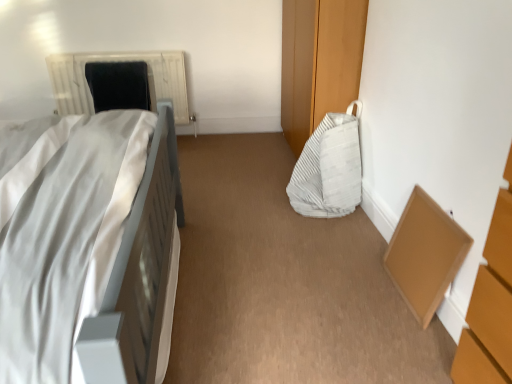
You are a GUI agent. You are given a task and a screenshot of the screen. Output one action in this format:
    pyautogui.click(x=<x>, y=<y>)
    Task: Click on the white matte bed at left
    The height and width of the screenshot is (384, 512).
    Given the screenshot: What is the action you would take?
    pyautogui.click(x=92, y=253)

Identify the location of white textured radiator at upper left. The width and height of the screenshot is (512, 384). (115, 61).

What is the approximate width of brown cardboard box at lower right?

11.20 centimeters.

Locate an element on the screen. The height and width of the screenshot is (384, 512). white striped fabric bean bag at center-right, marked as the first bean bag chair in a right-to-left arrangement is located at coordinates (329, 168).

Find the location of a particular element. Image resolution: width=512 pixels, height=384 pixels. white matte bed at left is located at coordinates (92, 253).

From the image's perspective, would you say white matte bed at left is positioned over white textured radiator at upper left?

No, from the image's perspective, white matte bed at left is not on top of white textured radiator at upper left.

Which of these two, white matte bed at left or white textured radiator at upper left, is bigger?

With larger size is white matte bed at left.

In order to click on radiator lying on the left of white matte bed at left in this screenshot , I will do `click(115, 61)`.

Could you tell me if white matte bed at left is facing white textured radiator at upper left?

No.

Is white textured radiator at upper left in front of or behind white striped fabric bean bag at center-right, which is the 2th bean bag chair from left to right, in the image?

In the image, white textured radiator at upper left appears behind white striped fabric bean bag at center-right, which is the 2th bean bag chair from left to right.

Would you say white striped fabric bean bag at center-right, marked as the first bean bag chair in a right-to-left arrangement, is part of white textured radiator at upper left's contents?

No, white striped fabric bean bag at center-right, marked as the first bean bag chair in a right-to-left arrangement, is not a part of white textured radiator at upper left.

Which object is positioned more to the left, white textured radiator at upper left or white striped fabric bean bag at center-right, acting as the 1th bean bag chair starting from the bottom?

white textured radiator at upper left is more to the left.

What's the angular difference between white textured radiator at upper left and white striped fabric bean bag at center-right, the 2th bean bag chair viewed from the top,'s facing directions?

The angle between the facing direction of white textured radiator at upper left and the facing direction of white striped fabric bean bag at center-right, the 2th bean bag chair viewed from the top, is 92.4 degrees.

Locate an element on the screen. This screenshot has height=384, width=512. bean bag chair that is under the black fabric bean bag at upper left, which is the second bean bag chair in bottom-to-top order (from a real-world perspective) is located at coordinates (329, 168).

Is white striped fabric bean bag at center-right, the second bean bag chair positioned from the back, shorter than black fabric bean bag at upper left, which is counted as the first bean bag chair, starting from the top?

No, white striped fabric bean bag at center-right, the second bean bag chair positioned from the back, is not shorter than black fabric bean bag at upper left, which is counted as the first bean bag chair, starting from the top.

From the picture: From a real-world perspective, is white striped fabric bean bag at center-right, arranged as the first bean bag chair when viewed from the front, above or below black fabric bean bag at upper left, which is the second bean bag chair in bottom-to-top order?

white striped fabric bean bag at center-right, arranged as the first bean bag chair when viewed from the front, is situated lower than black fabric bean bag at upper left, which is the second bean bag chair in bottom-to-top order, in the real world.

How many degrees apart are the facing directions of white striped fabric bean bag at center-right, acting as the 1th bean bag chair starting from the bottom, and black fabric bean bag at upper left, which appears as the 1th bean bag chair when viewed from the back?

There is a 92.4-degree angle between the facing directions of white striped fabric bean bag at center-right, acting as the 1th bean bag chair starting from the bottom, and black fabric bean bag at upper left, which appears as the 1th bean bag chair when viewed from the back.

Which object is thinner, white textured radiator at upper left or black fabric bean bag at upper left, which is the second bean bag chair in bottom-to-top order?

Thinner between the two is black fabric bean bag at upper left, which is the second bean bag chair in bottom-to-top order.

Is white textured radiator at upper left positioned beyond the bounds of black fabric bean bag at upper left, which ranks as the second bean bag chair in front-to-back order?

Indeed, white textured radiator at upper left is completely outside black fabric bean bag at upper left, which ranks as the second bean bag chair in front-to-back order.

Identify the location of cardboard box located on the right of white matte bed at left. (425, 254).

Considering the relative positions of white matte bed at left and brown cardboard box at lower right in the image provided, is white matte bed at left to the left or to the right of brown cardboard box at lower right?

In the image, white matte bed at left appears on the left side of brown cardboard box at lower right.

Consider the image. Is white matte bed at left looking in the opposite direction of brown cardboard box at lower right?

No, white matte bed at left's orientation is not away from brown cardboard box at lower right.

Does black fabric bean bag at upper left, the second bean bag chair viewed from the right, have a smaller size compared to white matte bed at left?

Yes, black fabric bean bag at upper left, the second bean bag chair viewed from the right, is smaller than white matte bed at left.

Does point (117, 75) come closer to viewer compared to point (39, 345)?

No, (117, 75) is behind (39, 345).

In terms of width, does black fabric bean bag at upper left, the second bean bag chair viewed from the right, look wider or thinner when compared to white matte bed at left?

black fabric bean bag at upper left, the second bean bag chair viewed from the right, is thinner than white matte bed at left.

Considering the points (101, 93) and (437, 263), which point is in front, point (101, 93) or point (437, 263)?

The point (437, 263) is in front.

From the image's perspective, is black fabric bean bag at upper left, the second bean bag chair viewed from the right, located above or below brown cardboard box at lower right?

From the image's perspective, black fabric bean bag at upper left, the second bean bag chair viewed from the right, appears above brown cardboard box at lower right.

Which is in front, black fabric bean bag at upper left, which appears as the 1th bean bag chair when viewed from the back, or brown cardboard box at lower right?

brown cardboard box at lower right is closer to the camera.

Considering the relative positions of black fabric bean bag at upper left, which is counted as the first bean bag chair, starting from the top, and brown cardboard box at lower right in the image provided, is black fabric bean bag at upper left, which is counted as the first bean bag chair, starting from the top, to the right of brown cardboard box at lower right from the viewer's perspective?

No, black fabric bean bag at upper left, which is counted as the first bean bag chair, starting from the top, is not to the right of brown cardboard box at lower right.

At what (x,y) coordinates should I click in order to perform the action: click on radiator lying above the white matte bed at left (from the image's perspective). Please return your answer as a coordinate pair (x, y). The image size is (512, 384). Looking at the image, I should click on (115, 61).

Locate an element on the screen. The height and width of the screenshot is (384, 512). radiator that appears above the white striped fabric bean bag at center-right, marked as the first bean bag chair in a right-to-left arrangement (from a real-world perspective) is located at coordinates (115, 61).

Based on their spatial positions, is white striped fabric bean bag at center-right, the 2th bean bag chair viewed from the top, or black fabric bean bag at upper left, which is the second bean bag chair in bottom-to-top order, further from white matte bed at left?

black fabric bean bag at upper left, which is the second bean bag chair in bottom-to-top order, is positioned further to the anchor white matte bed at left.

From the image, which object appears to be nearer to white striped fabric bean bag at center-right, arranged as the first bean bag chair when viewed from the front, white matte bed at left or white textured radiator at upper left?

white matte bed at left.

Considering their positions, is black fabric bean bag at upper left, which ranks as the second bean bag chair in front-to-back order, positioned further to white striped fabric bean bag at center-right, which is the 2th bean bag chair from left to right, than brown cardboard box at lower right?

black fabric bean bag at upper left, which ranks as the second bean bag chair in front-to-back order, lies further to white striped fabric bean bag at center-right, which is the 2th bean bag chair from left to right, than the other object.

Considering their positions, is white textured radiator at upper left positioned closer to white striped fabric bean bag at center-right, marked as the first bean bag chair in a right-to-left arrangement, than white matte bed at left?

Among the two, white matte bed at left is located nearer to white striped fabric bean bag at center-right, marked as the first bean bag chair in a right-to-left arrangement.

Estimate the real-world distances between objects in this image. Which object is further from white striped fabric bean bag at center-right, which is the 2th bean bag chair from left to right, brown cardboard box at lower right or white textured radiator at upper left?

white textured radiator at upper left.

In the scene shown: Looking at the image, which one is located closer to brown cardboard box at lower right, white matte bed at left or white textured radiator at upper left?

white matte bed at left is positioned closer to the anchor brown cardboard box at lower right.

When comparing their distances from white striped fabric bean bag at center-right, the second bean bag chair positioned from the back, does white textured radiator at upper left or brown cardboard box at lower right seem further?

white textured radiator at upper left is further to white striped fabric bean bag at center-right, the second bean bag chair positioned from the back.

Estimate the real-world distances between objects in this image. Which object is further from black fabric bean bag at upper left, which ranks as the second bean bag chair in front-to-back order, brown cardboard box at lower right or white textured radiator at upper left?

brown cardboard box at lower right is further to black fabric bean bag at upper left, which ranks as the second bean bag chair in front-to-back order.

This screenshot has width=512, height=384. Find the location of `cardboard box between white matte bed at left and black fabric bean bag at upper left, which is counted as the first bean bag chair, starting from the top, along the z-axis`. cardboard box between white matte bed at left and black fabric bean bag at upper left, which is counted as the first bean bag chair, starting from the top, along the z-axis is located at coordinates (425, 254).

This screenshot has height=384, width=512. Find the location of `bean bag chair situated between black fabric bean bag at upper left, which is the second bean bag chair in bottom-to-top order, and brown cardboard box at lower right from left to right`. bean bag chair situated between black fabric bean bag at upper left, which is the second bean bag chair in bottom-to-top order, and brown cardboard box at lower right from left to right is located at coordinates (329, 168).

I want to click on bean bag chair between white matte bed at left and black fabric bean bag at upper left, which is counted as the first bean bag chair, starting from the top, in the front-back direction, so (x=329, y=168).

Identify the location of cardboard box between white matte bed at left and white striped fabric bean bag at center-right, acting as the 1th bean bag chair starting from the bottom, in the front-back direction. The image size is (512, 384). (425, 254).